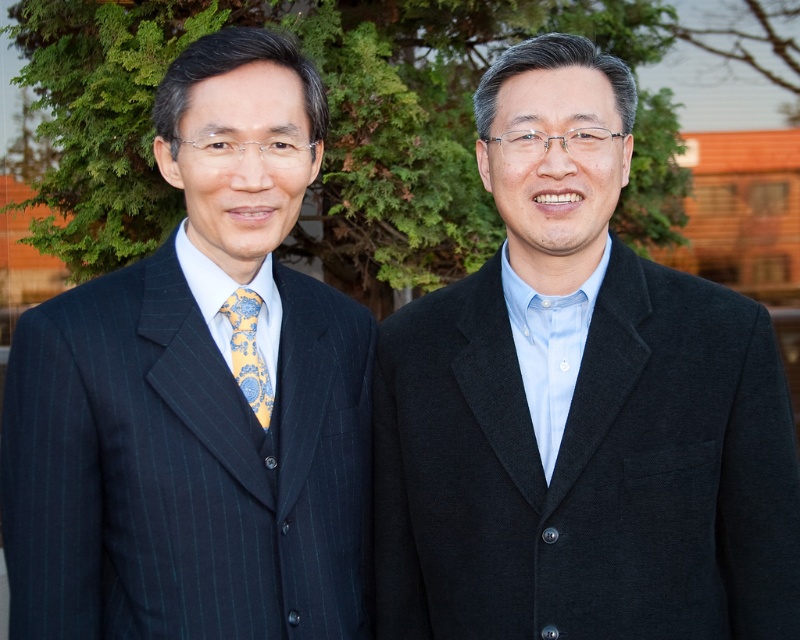
Question: Is dark gray woolen suit at right closer to the viewer compared to yellow floral silk tie at left?

Choices:
 (A) yes
 (B) no

Answer: (A)

Question: Based on their relative distances, which object is nearer to the dark gray woolen suit at right?

Choices:
 (A) pinstriped suit at left
 (B) yellow floral silk tie at left

Answer: (A)

Question: Can you confirm if pinstriped suit at left is positioned below dark gray woolen suit at right?

Choices:
 (A) no
 (B) yes

Answer: (A)

Question: Considering the real-world distances, which object is farthest from the pinstriped suit at left?

Choices:
 (A) dark gray woolen suit at right
 (B) yellow floral silk tie at left

Answer: (A)

Question: From the image, what is the correct spatial relationship of pinstriped suit at left in relation to dark gray woolen suit at right?

Choices:
 (A) left
 (B) right

Answer: (A)

Question: Estimate the real-world distances between objects in this image. Which object is farther from the dark gray woolen suit at right?

Choices:
 (A) yellow floral silk tie at left
 (B) pinstriped suit at left

Answer: (A)